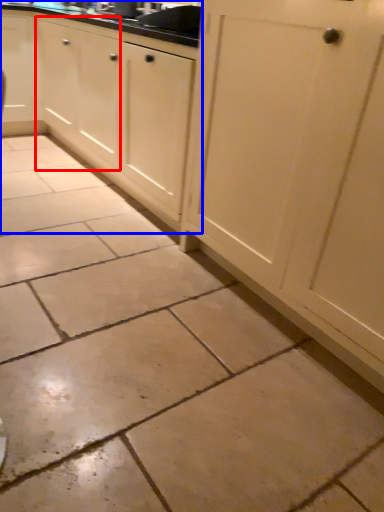
Question: Which point is closer to the camera, cabinetry (highlighted by a red box) or cabinetry (highlighted by a blue box)?

Choices:
 (A) cabinetry
 (B) cabinetry

Answer: (B)